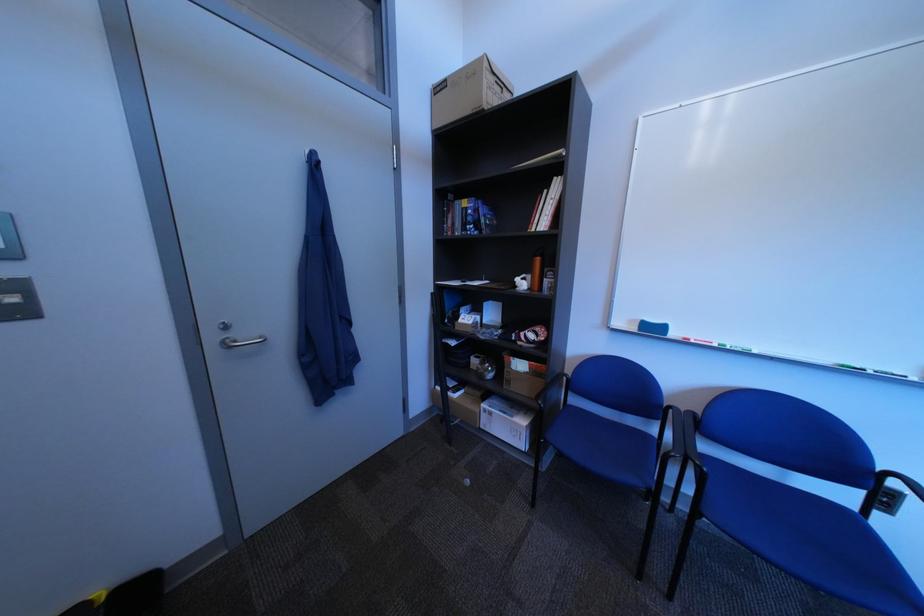
Identify the location of door hook. (225, 331).